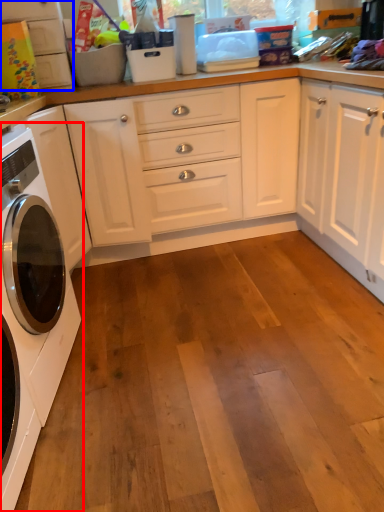
Question: Which object is further to the camera taking this photo, washing machine (highlighted by a red box) or cabinetry (highlighted by a blue box)?

Choices:
 (A) washing machine
 (B) cabinetry

Answer: (B)